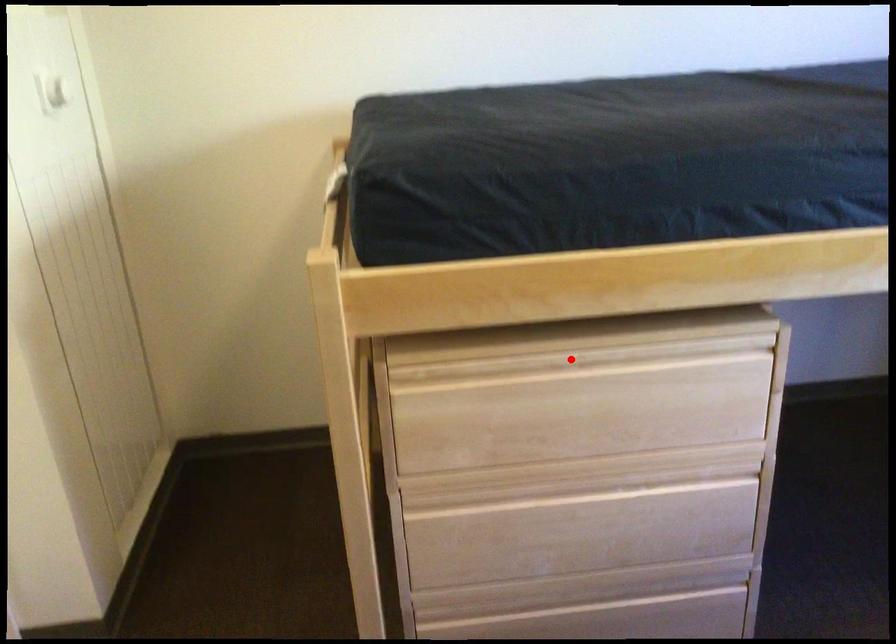
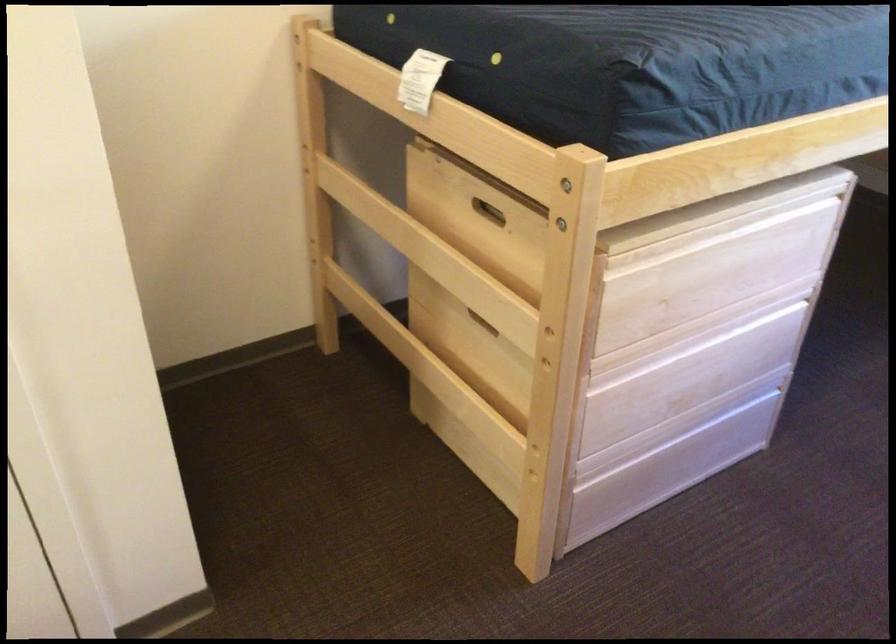
Question: I am providing you with two images of the same scene from different viewpoints. Image1 has a red point marked. In image2, the corresponding 3D location appears at what relative position? Reply with the corresponding letter.

Choices:
 (A) Closer
 (B) Farther

Answer: (B)